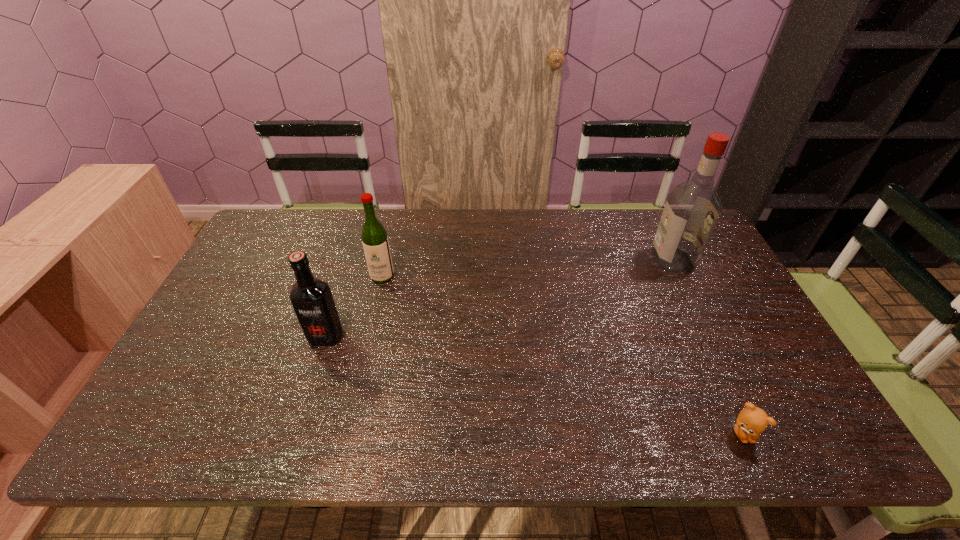
The image size is (960, 540). Find the location of `free space at the left edge of the desktop`. free space at the left edge of the desktop is located at coordinates (263, 319).

Find the location of a particular element. This screenshot has width=960, height=540. free location at the right edge is located at coordinates (755, 358).

Where is `free space between the nearest liquor and the third object from right to left`? The height and width of the screenshot is (540, 960). free space between the nearest liquor and the third object from right to left is located at coordinates (354, 306).

The height and width of the screenshot is (540, 960). Find the location of `free space between the rightmost liquor and the third object from right to left`. free space between the rightmost liquor and the third object from right to left is located at coordinates pyautogui.click(x=527, y=268).

Identify the location of free spot between the nearest liquor and the tallest object. The height and width of the screenshot is (540, 960). (499, 298).

Where is `empty space that is in between the second object from left to right and the teddy bear`? This screenshot has width=960, height=540. empty space that is in between the second object from left to right and the teddy bear is located at coordinates click(563, 355).

At what (x,y) coordinates should I click in order to perform the action: click on free area in between the nearest object and the rightmost liquor. Please return your answer as a coordinate pair (x, y). This screenshot has height=540, width=960. Looking at the image, I should click on (708, 347).

Locate an element on the screen. This screenshot has width=960, height=540. free point between the leftmost liquor and the tallest object is located at coordinates (499, 298).

Identify the location of unoccupied position between the third object from right to left and the nearest liquor. (354, 306).

At what (x,y) coordinates should I click in order to perform the action: click on free spot between the second nearest object and the tallest object. Please return your answer as a coordinate pair (x, y). Looking at the image, I should click on (499, 298).